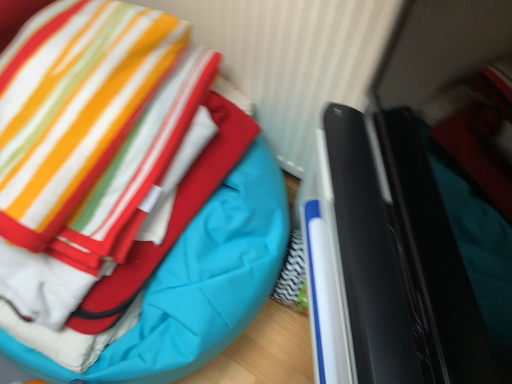
Question: Choose the correct answer: Is black glossy laptop at right inside teal quilted bean bag at center or outside it?

Choices:
 (A) inside
 (B) outside

Answer: (B)

Question: Visually, is black glossy laptop at right positioned to the left or to the right of teal quilted bean bag at center?

Choices:
 (A) left
 (B) right

Answer: (B)

Question: From a real-world perspective, relative to teal quilted bean bag at center, is black glossy laptop at right vertically above or below?

Choices:
 (A) above
 (B) below

Answer: (A)

Question: In terms of size, does teal quilted bean bag at center appear bigger or smaller than black glossy laptop at right?

Choices:
 (A) big
 (B) small

Answer: (A)

Question: Is teal quilted bean bag at center to the left or to the right of black glossy laptop at right in the image?

Choices:
 (A) left
 (B) right

Answer: (A)

Question: Is point (163, 374) positioned closer to the camera than point (394, 331)?

Choices:
 (A) farther
 (B) closer

Answer: (A)

Question: From the image's perspective, is teal quilted bean bag at center located above or below black glossy laptop at right?

Choices:
 (A) above
 (B) below

Answer: (A)